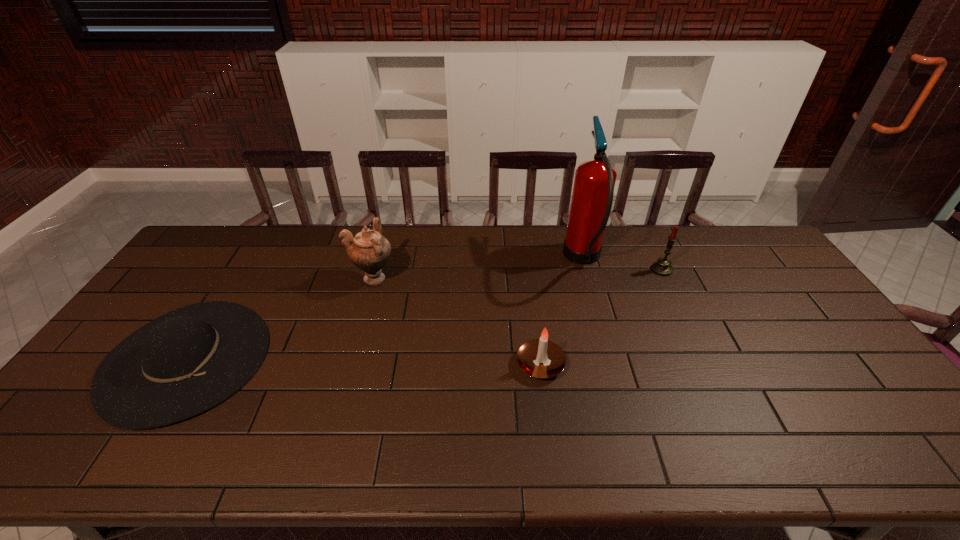
In the image, there is a desktop. At what (x,y) coordinates should I click in order to perform the action: click on vacant space at the near edge. Please return your answer as a coordinate pair (x, y). Image resolution: width=960 pixels, height=540 pixels. Looking at the image, I should click on (521, 433).

Find the location of a particular element. vacant point at the right edge is located at coordinates (818, 339).

In the image, there is a desktop. Where is `vacant space at the far left corner`? The height and width of the screenshot is (540, 960). vacant space at the far left corner is located at coordinates (197, 244).

Find the location of a particular element. This screenshot has height=540, width=960. vacant space at the far right corner is located at coordinates (748, 238).

You are a GUI agent. You are given a task and a screenshot of the screen. Output one action in this format:
    pyautogui.click(x=<x>, y=<y>)
    Task: Click on the vacant space that is in between the fire extinguisher and the nearer candle
    The image size is (960, 540).
    Given the screenshot: What is the action you would take?
    click(x=562, y=312)

This screenshot has height=540, width=960. What are the coordinates of `free spot between the sombrero and the fourth object from left to right` in the screenshot? It's located at (385, 309).

You are a GUI agent. You are given a task and a screenshot of the screen. Output one action in this format:
    pyautogui.click(x=<x>, y=<y>)
    Task: Click on the free space between the left candle and the fourth object from left to right
    The image size is (960, 540).
    Given the screenshot: What is the action you would take?
    pyautogui.click(x=562, y=312)

Find the location of a particular element. This screenshot has width=960, height=540. free spot between the tallest object and the third object from left to right is located at coordinates (562, 312).

The image size is (960, 540). I want to click on vacant space that is in between the leftmost object and the farther candle, so click(424, 314).

Locate an element on the screen. This screenshot has height=540, width=960. vacant point located between the rightmost object and the second object from left to right is located at coordinates (517, 274).